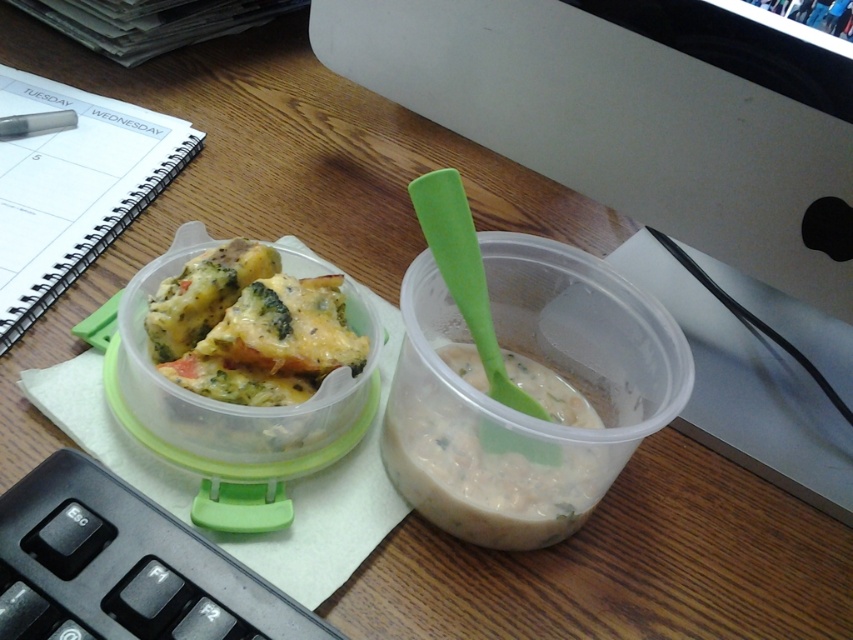
You are a delivery person who needs to pick up the baked dish from the left container. There is a point marked at coordinates (483, 467). Can you tell me which direction you should move your hand to reach the baked dish container from that point?

The point at (483, 467) is where the white creamy soup at center is located. To reach the baked dish container on the left, you should move your hand to the left from that point.

You are organizing items on a desk and need to place a metallic silver pen at upper left and a white creamy soup at center. According to the image, which item is located to the right of the other?

The white creamy soup at center is positioned on the right side of metallic silver pen at upper left.